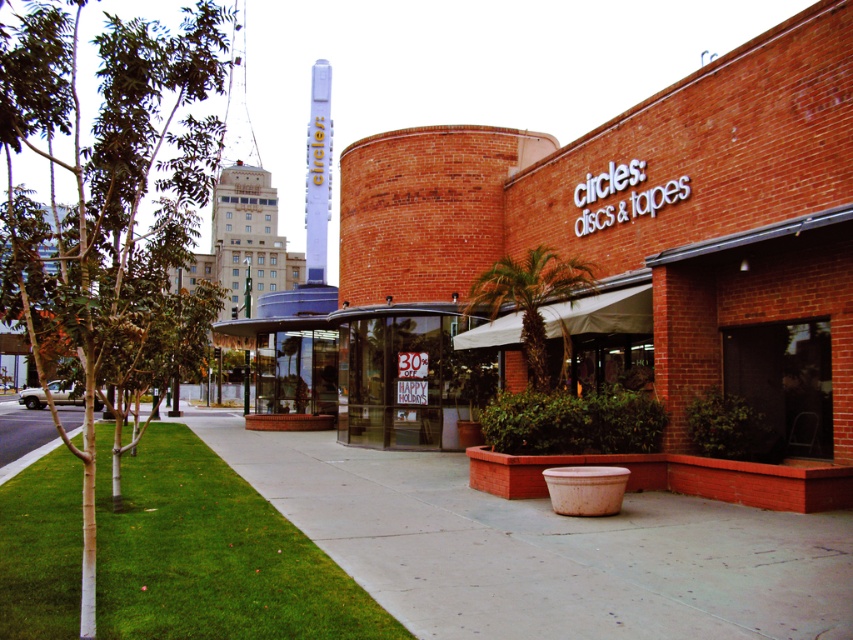
Question: Can you confirm if concrete at center is thinner than green leafy palm at center?

Choices:
 (A) no
 (B) yes

Answer: (A)

Question: Is concrete at center bigger than green grass at lower left?

Choices:
 (A) no
 (B) yes

Answer: (B)

Question: Which of these objects is positioned farthest from the green leafy palm at center?

Choices:
 (A) concrete at center
 (B) green grass at lower left

Answer: (B)

Question: Among these objects, which one is farthest from the camera?

Choices:
 (A) green grass at lower left
 (B) green leafy palm at center

Answer: (B)

Question: Estimate the real-world distances between objects in this image. Which object is farther from the concrete at center?

Choices:
 (A) green leafy palm at center
 (B) green grass at lower left
 (C) green leafy tree at left

Answer: (C)

Question: Can you confirm if concrete at center is wider than green leafy tree at left?

Choices:
 (A) no
 (B) yes

Answer: (A)